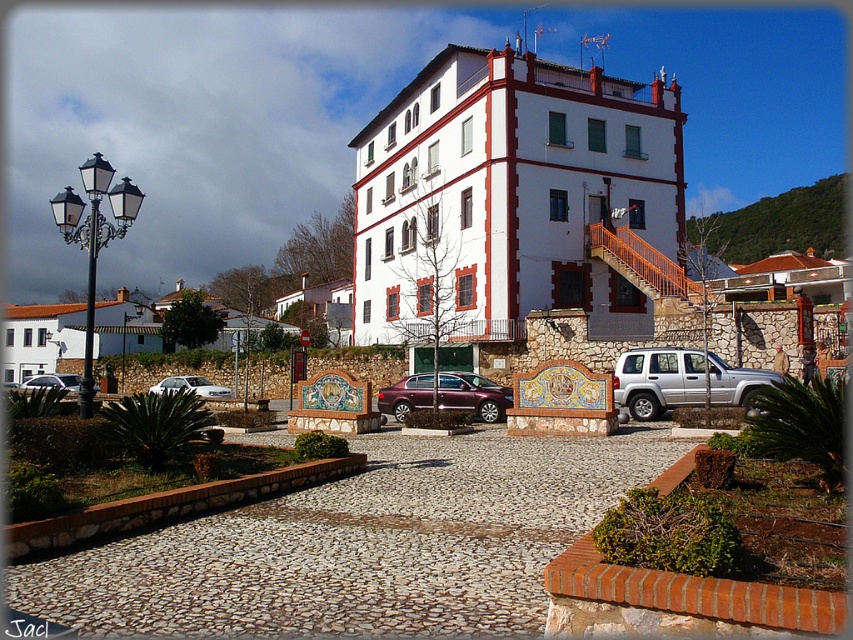
Question: Which of these objects is positioned closest to the matte maroon sedan at center?

Choices:
 (A) silver metallic sedan at center
 (B) white glossy sedan at lower left
 (C) silver metallic suv at right

Answer: (C)

Question: Among these objects, which one is nearest to the camera?

Choices:
 (A) matte maroon sedan at center
 (B) white glossy sedan at lower left
 (C) silver metallic suv at right

Answer: (C)

Question: Can you confirm if white glossy sedan at lower left is positioned above silver metallic sedan at center?

Choices:
 (A) no
 (B) yes

Answer: (A)

Question: Can you confirm if silver metallic suv at right is positioned above silver metallic sedan at center?

Choices:
 (A) yes
 (B) no

Answer: (A)

Question: Which is nearer to the matte maroon sedan at center?

Choices:
 (A) silver metallic sedan at center
 (B) white glossy sedan at lower left

Answer: (B)

Question: Is silver metallic suv at right thinner than matte maroon sedan at center?

Choices:
 (A) yes
 (B) no

Answer: (B)